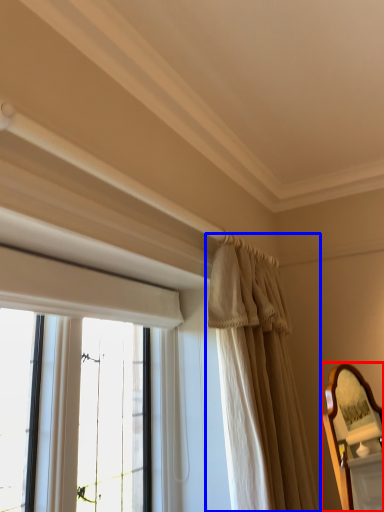
Question: Among these objects, which one is farthest to the camera, mirror (highlighted by a red box) or curtain (highlighted by a blue box)?

Choices:
 (A) mirror
 (B) curtain

Answer: (B)